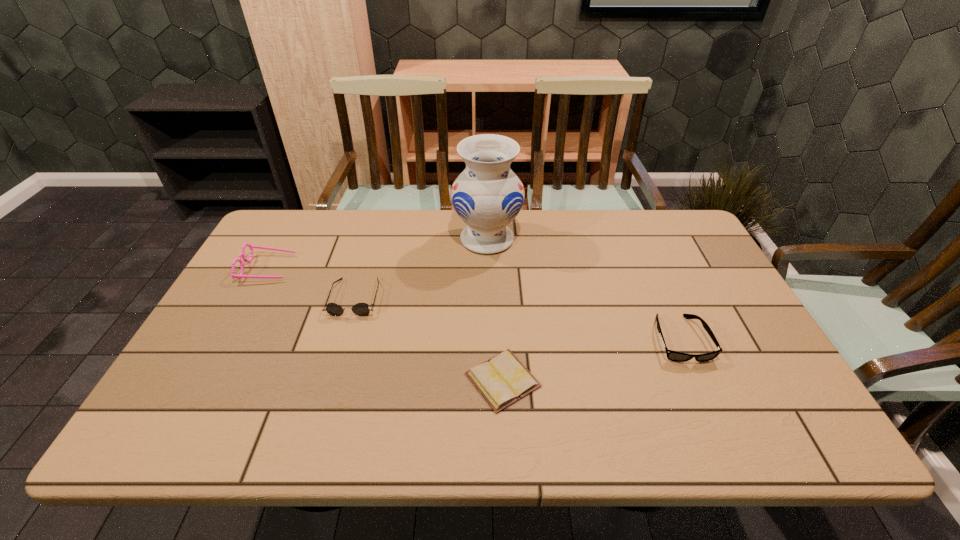
You are a GUI agent. You are given a task and a screenshot of the screen. Output one action in this format:
    pyautogui.click(x=<x>, y=<y>)
    Task: Click on the vacant position at the near left corner of the desktop
    
    Given the screenshot: What is the action you would take?
    pyautogui.click(x=213, y=434)

Identify the location of free area in between the leftmost object and the right sunglasses. (474, 303).

Locate an element on the screen. vacant point located between the rightmost object and the left sunglasses is located at coordinates (517, 318).

Locate an element on the screen. Image resolution: width=960 pixels, height=540 pixels. free spot between the diary and the fourth object from right to left is located at coordinates (429, 339).

Image resolution: width=960 pixels, height=540 pixels. In order to click on free spot between the shortest object and the vase in this screenshot , I will do `click(495, 309)`.

This screenshot has height=540, width=960. I want to click on free space between the diary and the right sunglasses, so click(591, 360).

Find the location of a particular element. The width and height of the screenshot is (960, 540). free space between the shortest object and the second tallest object is located at coordinates (385, 324).

Where is `vacant space that's between the rightmost object and the fourth shortest object`? This screenshot has height=540, width=960. vacant space that's between the rightmost object and the fourth shortest object is located at coordinates (474, 303).

I want to click on vacant area that lies between the fourth shortest object and the fourth object from right to left, so click(312, 283).

Where is `free space between the spectacles and the vase`? This screenshot has height=540, width=960. free space between the spectacles and the vase is located at coordinates (377, 254).